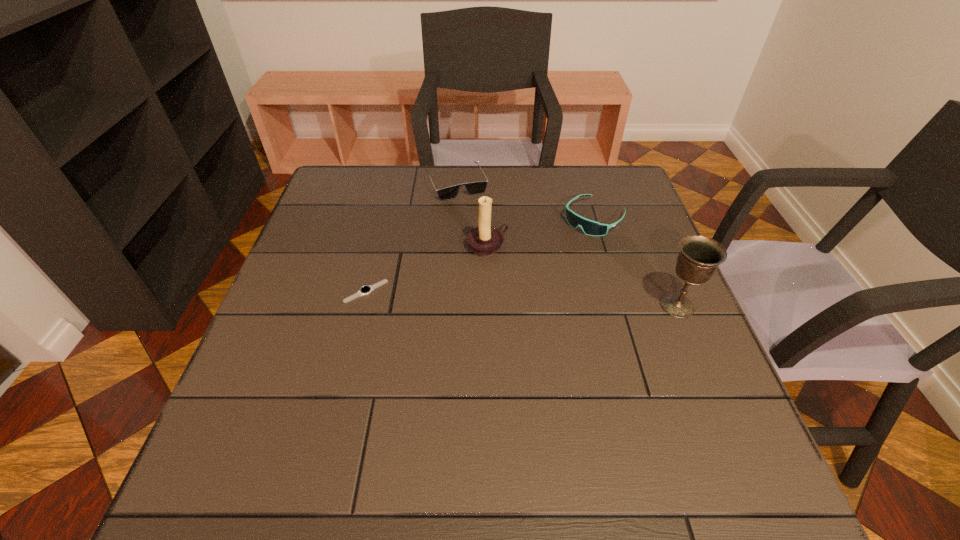
Locate an element on the screen. Image resolution: width=960 pixels, height=540 pixels. watch is located at coordinates [364, 290].

At what (x,y) coordinates should I click in order to perform the action: click on the shortest object. Please return your answer as a coordinate pair (x, y). Image resolution: width=960 pixels, height=540 pixels. Looking at the image, I should click on (364, 290).

At what (x,y) coordinates should I click in order to perform the action: click on chalice. Please return your answer as a coordinate pair (x, y). The image size is (960, 540). Looking at the image, I should click on (699, 257).

Locate an element on the screen. The image size is (960, 540). the taller sunglasses is located at coordinates click(x=592, y=228).

At what (x,y) coordinates should I click in order to perform the action: click on the right sunglasses. Please return your answer as a coordinate pair (x, y). Image resolution: width=960 pixels, height=540 pixels. Looking at the image, I should click on (592, 228).

Find the location of a particular element. the shorter sunglasses is located at coordinates (474, 188).

This screenshot has width=960, height=540. Identify the location of the second shortest object. (474, 188).

At what (x,y) coordinates should I click in order to perform the action: click on candle holder. Please return your answer as a coordinate pair (x, y). The height and width of the screenshot is (540, 960). Looking at the image, I should click on (484, 241).

Where is `vacant area situated 0.250m on the front of the watch`? vacant area situated 0.250m on the front of the watch is located at coordinates tap(338, 404).

The image size is (960, 540). Find the location of `vacant space located on the front of the chalice`. vacant space located on the front of the chalice is located at coordinates (697, 352).